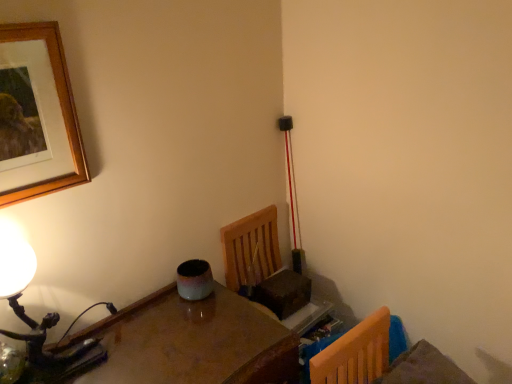
Question: Is glossy wooden table at lower left completely or partially outside of wooden picture frame at upper left?

Choices:
 (A) no
 (B) yes

Answer: (B)

Question: Is glossy wooden table at lower left not near wooden picture frame at upper left?

Choices:
 (A) no
 (B) yes

Answer: (A)

Question: Does glossy wooden table at lower left have a smaller size compared to wooden picture frame at upper left?

Choices:
 (A) yes
 (B) no

Answer: (B)

Question: Is glossy wooden table at lower left taller than wooden picture frame at upper left?

Choices:
 (A) no
 (B) yes

Answer: (B)

Question: Considering the relative sizes of glossy wooden table at lower left and wooden picture frame at upper left in the image provided, is glossy wooden table at lower left wider than wooden picture frame at upper left?

Choices:
 (A) yes
 (B) no

Answer: (A)

Question: Looking at the image, does wooden picture frame at upper left seem bigger or smaller compared to matte black table lamp at left?

Choices:
 (A) small
 (B) big

Answer: (A)

Question: Is wooden picture frame at upper left to the left or to the right of matte black table lamp at left in the image?

Choices:
 (A) right
 (B) left

Answer: (B)

Question: Considering the positions of wooden picture frame at upper left and matte black table lamp at left in the image, is wooden picture frame at upper left wider or thinner than matte black table lamp at left?

Choices:
 (A) thin
 (B) wide

Answer: (A)

Question: From a real-world perspective, is wooden picture frame at upper left physically located above or below matte black table lamp at left?

Choices:
 (A) above
 (B) below

Answer: (A)

Question: Would you say glossy wooden table at lower left is to the left or to the right of matte black table lamp at left in the picture?

Choices:
 (A) right
 (B) left

Answer: (A)

Question: Is glossy wooden table at lower left situated inside matte black table lamp at left or outside?

Choices:
 (A) inside
 (B) outside

Answer: (B)

Question: From the image's perspective, is glossy wooden table at lower left above or below matte black table lamp at left?

Choices:
 (A) above
 (B) below

Answer: (B)

Question: From a real-world perspective, relative to matte black table lamp at left, is glossy wooden table at lower left vertically above or below?

Choices:
 (A) above
 (B) below

Answer: (B)

Question: Considering the relative positions of matte black table lamp at left and glossy wooden table at lower left in the image provided, is matte black table lamp at left to the left or to the right of glossy wooden table at lower left?

Choices:
 (A) right
 (B) left

Answer: (B)

Question: In the image, is matte black table lamp at left positioned in front of or behind glossy wooden table at lower left?

Choices:
 (A) behind
 (B) front

Answer: (A)